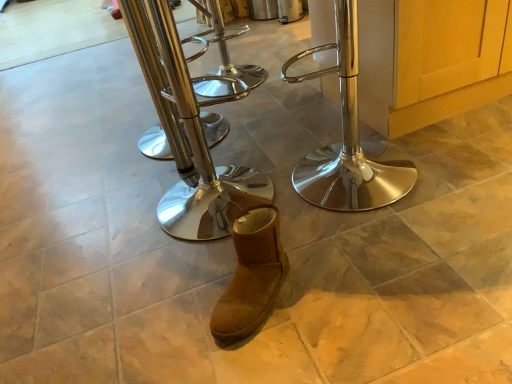
Locate an element on the screen. This screenshot has height=384, width=512. vacant area to the left of polished chrome stool at center, which appears as the 1th step stool when viewed from the right is located at coordinates (262, 185).